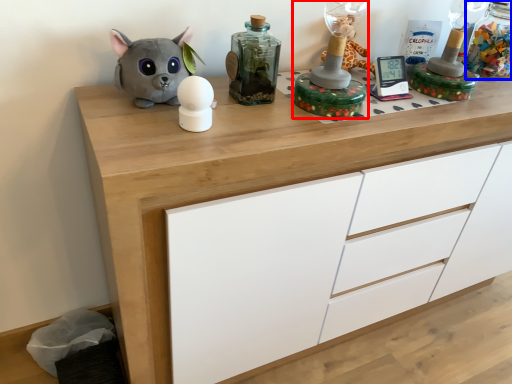
Question: Which object is further to the camera taking this photo, toy (highlighted by a red box) or bottle (highlighted by a blue box)?

Choices:
 (A) toy
 (B) bottle

Answer: (B)